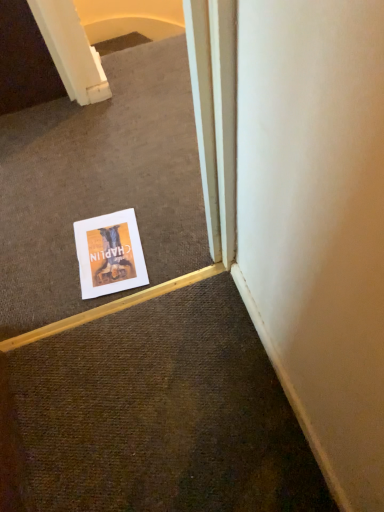
Image resolution: width=384 pixels, height=512 pixels. What are the coordinates of `free location to the left of white paper poster at center` in the screenshot? It's located at (43, 267).